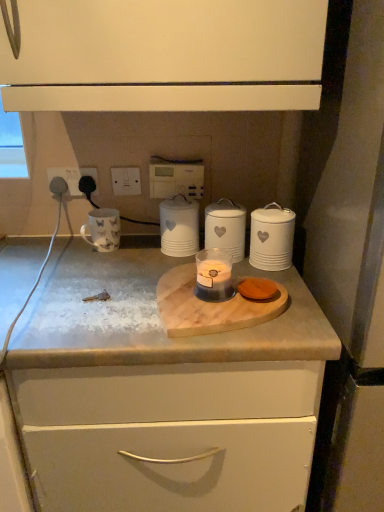
In order to click on vacant location behind translucent glass candle at center in this screenshot , I will do `click(186, 264)`.